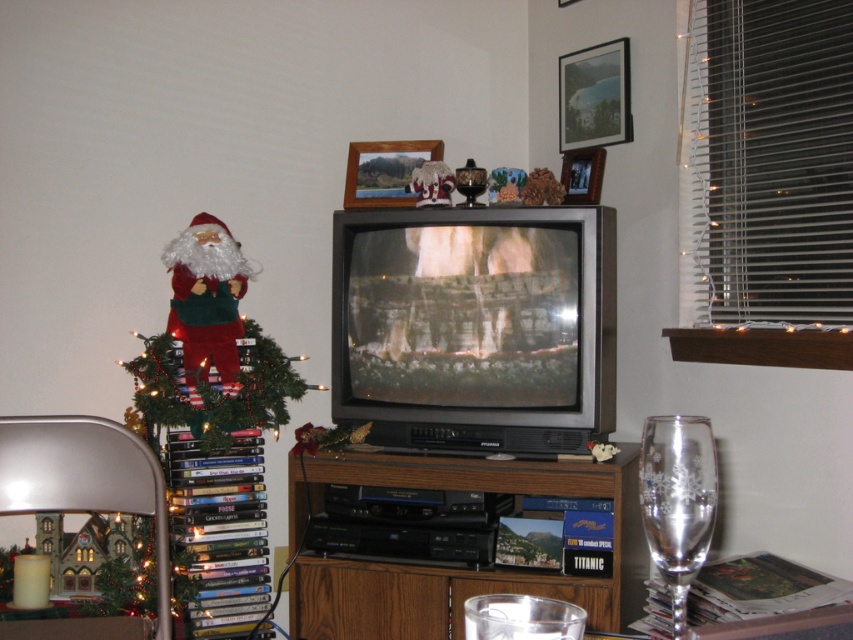
You are at the lower right corner of the living room and want to grab the clear glass wine glass at lower right. Is there enough space to reach it without bumping into the Christmas tree or the stack of DVDs?

The clear glass wine glass at lower right is located at point (677,500), which is far enough from the Christmas tree and the stack of DVDs to allow reaching it without obstruction.

You are standing in the living room and want to place a new decoration at a spot that is exactly 8 feet away from you. Is the point marked at coordinates point (518, 480) suitable for this purpose?

The distance of point (518, 480) from camera is 7.81 feet, which is slightly less than 8 feet. Therefore, the point is not exactly 8 feet away and may not be suitable for placing the decoration if precise distance is required.